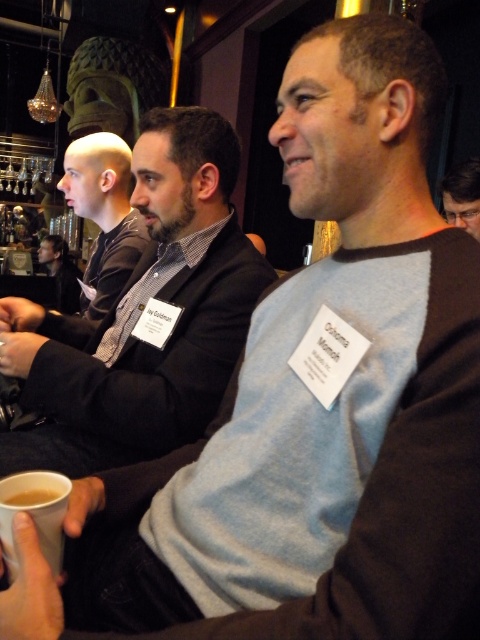
Question: Which is nearer to the matte black jacket at center?

Choices:
 (A) brown matte cup at lower left
 (B) bald head at left
 (C) light blue sweater at center
 (D) clear plastic glasses at upper right

Answer: (B)

Question: Does matte black jacket at center appear on the right side of brown matte cup at lower left?

Choices:
 (A) yes
 (B) no

Answer: (B)

Question: Estimate the real-world distances between objects in this image. Which object is closer to the light blue sweater at center?

Choices:
 (A) brown paper cup at lower left
 (B) brown matte cup at lower left
 (C) bald head at left

Answer: (C)

Question: Which point appears farthest from the camera in this image?

Choices:
 (A) (62, 310)
 (B) (463, 221)

Answer: (A)

Question: Can you confirm if light blue sweater at center is bigger than brown matte cup at lower left?

Choices:
 (A) no
 (B) yes

Answer: (B)

Question: In this image, where is bald head at left located relative to matte black jacket at center?

Choices:
 (A) right
 (B) left

Answer: (A)